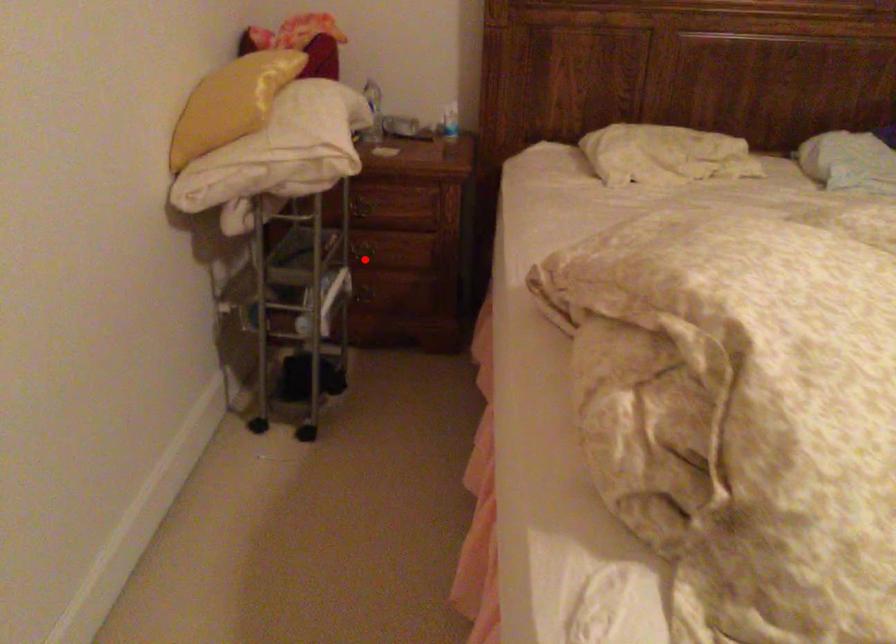
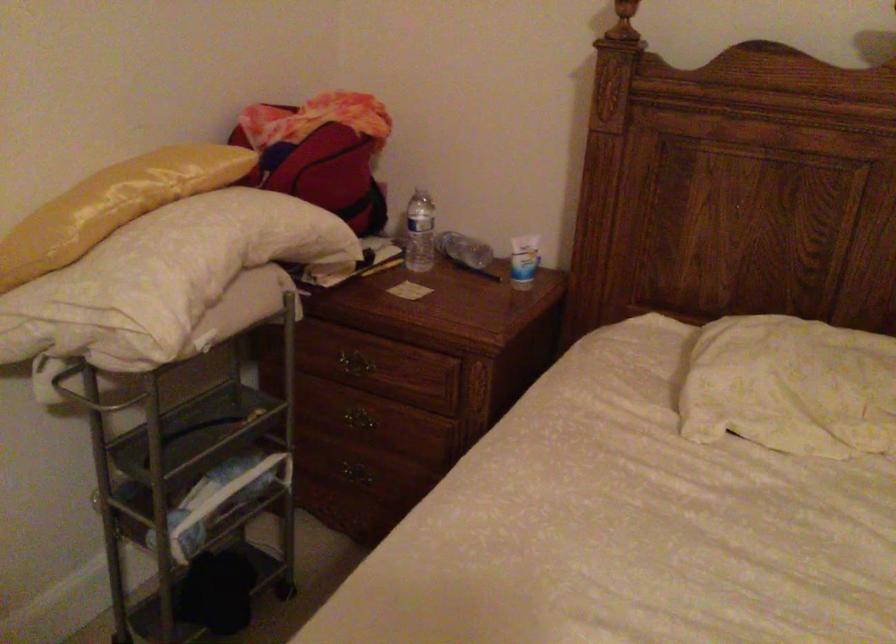
Question: I am providing you with two images of the same scene from different viewpoints. Image1 has a red point marked. In image2, the corresponding 3D location appears at what relative position? Reply with the corresponding letter.

Choices:
 (A) Closer
 (B) Farther

Answer: (A)